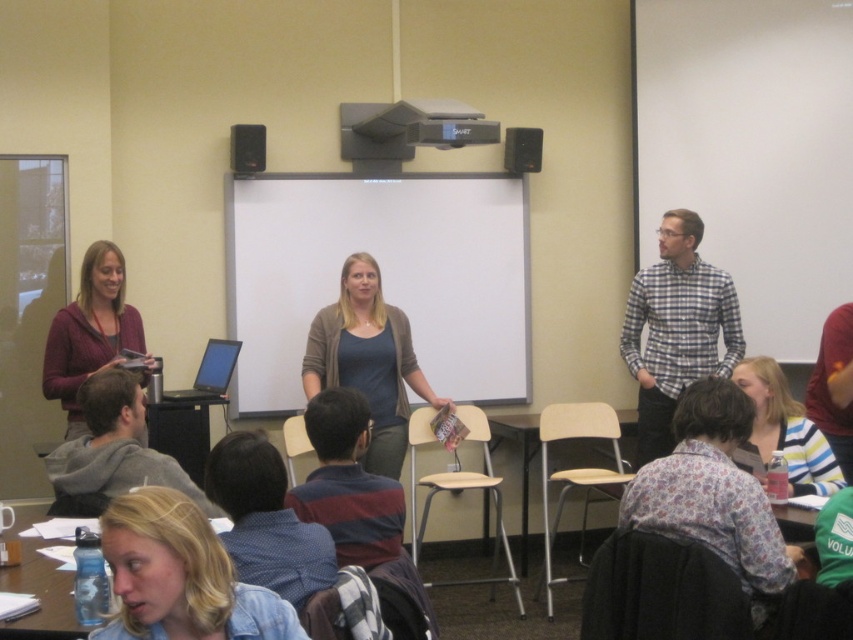
Question: Is matte gray sweater at center positioned before clear plastic water bottle at lower left?

Choices:
 (A) no
 (B) yes

Answer: (A)

Question: Does black plastic table at lower left have a smaller size compared to matte black speaker at upper left?

Choices:
 (A) yes
 (B) no

Answer: (B)

Question: Which of these objects is positioned closest to the blonde hair at lower center?

Choices:
 (A) matte gray sweater at center
 (B) black plastic table at lower left
 (C) matte black speaker at upper left

Answer: (B)

Question: Considering the real-world distances, which object is closest to the matte black speaker at upper center?

Choices:
 (A) black plastic table at lower left
 (B) clear plastic water bottle at lower left
 (C) matte purple sweater at left
 (D) matte gray sweater at center

Answer: (D)

Question: Which of the following is the closest to the observer?

Choices:
 (A) (254, 164)
 (B) (210, 392)

Answer: (B)

Question: Where is checkered fabric shirt at right located in relation to matte purple sweater at left in the image?

Choices:
 (A) left
 (B) right

Answer: (B)